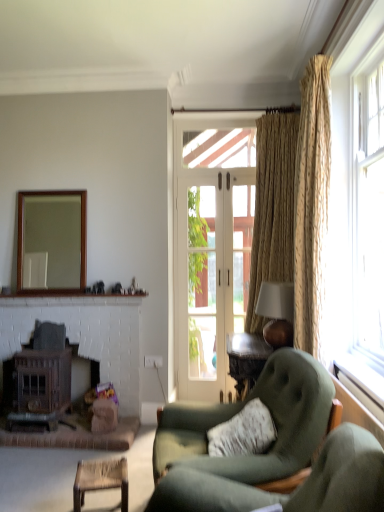
Question: Does rattan chair at lower left have a greater height compared to clear glass door at center?

Choices:
 (A) no
 (B) yes

Answer: (A)

Question: Is rattan chair at lower left smaller than clear glass door at center?

Choices:
 (A) no
 (B) yes

Answer: (B)

Question: Is clear glass door at center completely or partially inside rattan chair at lower left?

Choices:
 (A) no
 (B) yes

Answer: (A)

Question: Is rattan chair at lower left outside clear glass door at center?

Choices:
 (A) no
 (B) yes

Answer: (B)

Question: Considering the relative positions of rattan chair at lower left and clear glass door at center in the image provided, is rattan chair at lower left to the right of clear glass door at center from the viewer's perspective?

Choices:
 (A) yes
 (B) no

Answer: (B)

Question: Is rattan chair at lower left turned away from clear glass door at center?

Choices:
 (A) no
 (B) yes

Answer: (A)

Question: Considering the relative sizes of gold textured curtain at right, arranged as the first curtain when viewed from the front, and matte brown lampshade at upper right in the image provided, is gold textured curtain at right, arranged as the first curtain when viewed from the front, shorter than matte brown lampshade at upper right?

Choices:
 (A) yes
 (B) no

Answer: (B)

Question: Is gold textured curtain at right, which is counted as the 2th curtain, starting from the back, not near matte brown lampshade at upper right?

Choices:
 (A) no
 (B) yes

Answer: (A)

Question: From a real-world perspective, is gold textured curtain at right, arranged as the first curtain when viewed from the front, positioned over matte brown lampshade at upper right based on gravity?

Choices:
 (A) no
 (B) yes

Answer: (B)

Question: Can you confirm if gold textured curtain at right, which is counted as the 2th curtain, starting from the back, is taller than matte brown lampshade at upper right?

Choices:
 (A) yes
 (B) no

Answer: (A)

Question: Does gold textured curtain at right, arranged as the first curtain when viewed from the front, have a lesser width compared to matte brown lampshade at upper right?

Choices:
 (A) yes
 (B) no

Answer: (A)

Question: From a real-world perspective, is gold textured curtain at right, arranged as the first curtain when viewed from the front, under matte brown lampshade at upper right?

Choices:
 (A) no
 (B) yes

Answer: (A)

Question: Can you confirm if wooden frame mirror at upper left is thinner than clear glass door at center?

Choices:
 (A) yes
 (B) no

Answer: (B)